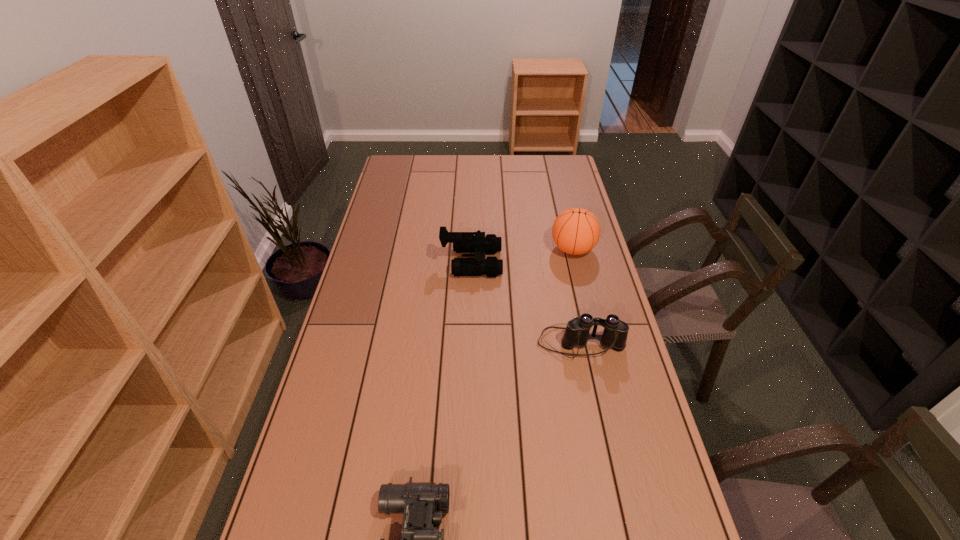
Where is `vacant point at the left edge`? vacant point at the left edge is located at coordinates (388, 247).

Where is `vacant space at the right edge of the desktop`? vacant space at the right edge of the desktop is located at coordinates (614, 437).

Identify the location of vacant space at the far right corner of the desktop. This screenshot has height=540, width=960. (554, 161).

I want to click on empty location between the farthest binoculars and the tallest object, so 522,255.

I want to click on unoccupied area between the rightmost binoculars and the farthest binoculars, so click(526, 302).

Where is `free point between the farthest binoculars and the tallest object`? free point between the farthest binoculars and the tallest object is located at coordinates (522, 255).

The height and width of the screenshot is (540, 960). In order to click on free spot between the third farthest object and the basketball in this screenshot , I will do `click(577, 296)`.

Find the location of a particular element. Image resolution: width=960 pixels, height=540 pixels. empty space that is in between the second farthest binoculars and the farthest binoculars is located at coordinates (526, 302).

Locate an element on the screen. Image resolution: width=960 pixels, height=540 pixels. vacant space that is in between the second farthest binoculars and the farthest binoculars is located at coordinates (526, 302).

Locate an element on the screen. The width and height of the screenshot is (960, 540). free spot between the rightmost binoculars and the farthest binoculars is located at coordinates (526, 302).